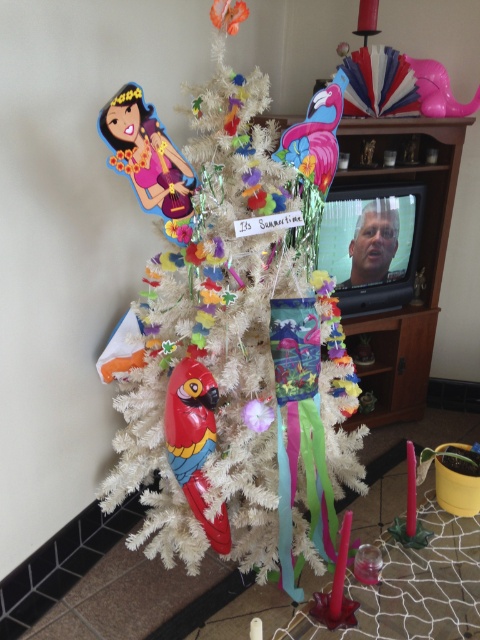
Question: Which point appears closest to the camera in this image?

Choices:
 (A) [x=166, y=253]
 (B) [x=190, y=465]

Answer: (B)

Question: Does white artificial christmas tree at center have a greater width compared to shiny plastic parrot at center?

Choices:
 (A) yes
 (B) no

Answer: (A)

Question: Which of the following is the closest to the observer?

Choices:
 (A) (116, 332)
 (B) (214, 536)

Answer: (B)

Question: Does white artificial christmas tree at center have a greater width compared to shiny plastic parrot at center?

Choices:
 (A) yes
 (B) no

Answer: (A)

Question: Can you confirm if white artificial christmas tree at center is positioned to the left of shiny plastic parrot at center?

Choices:
 (A) no
 (B) yes

Answer: (A)